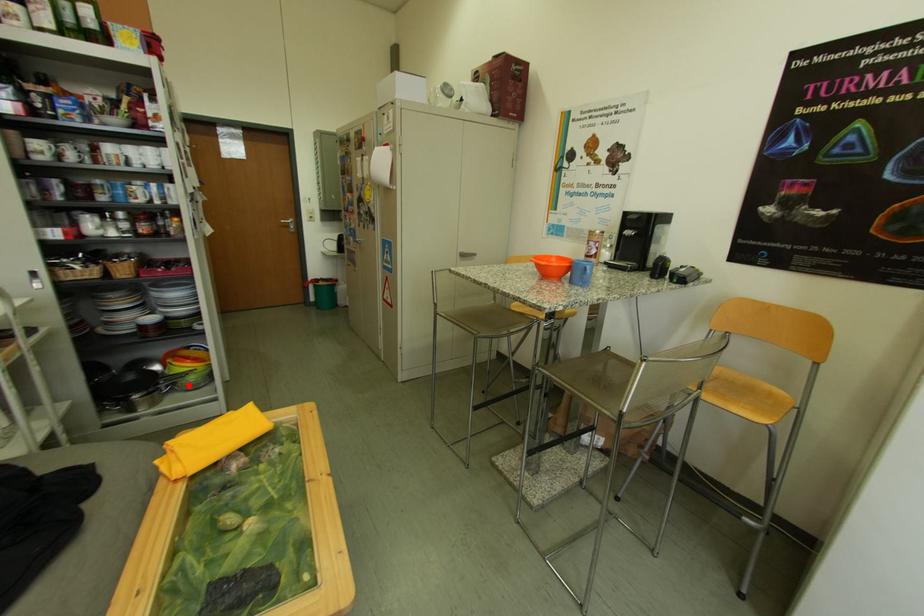
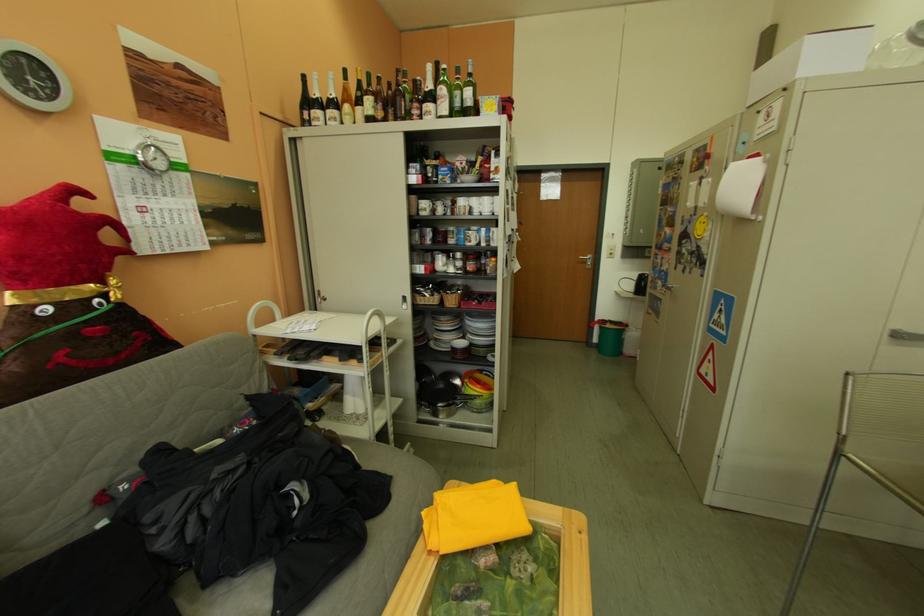
The point at the highlighted location is marked in the first image. Where is the corresponding point in the second image?

(478, 405)